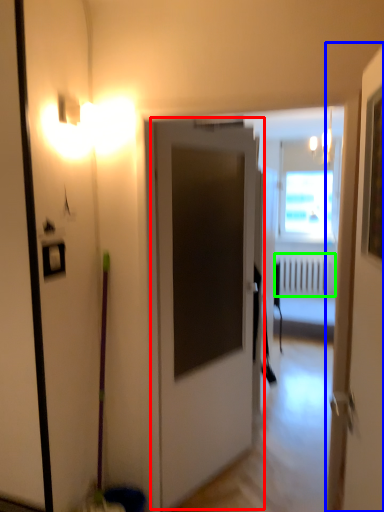
Question: Which is farther away from door (highlighted by a red box)? door (highlighted by a blue box) or radiator (highlighted by a green box)?

Choices:
 (A) door
 (B) radiator

Answer: (B)